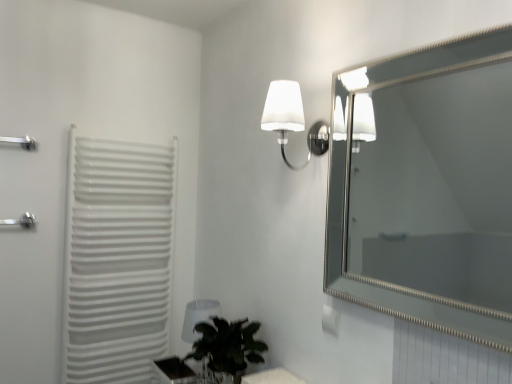
Question: Does green leafy plant at lower center appear on the right side of white plastic radiator at left?

Choices:
 (A) no
 (B) yes

Answer: (B)

Question: Can you confirm if green leafy plant at lower center is smaller than white plastic radiator at left?

Choices:
 (A) yes
 (B) no

Answer: (A)

Question: Is green leafy plant at lower center shorter than white plastic radiator at left?

Choices:
 (A) yes
 (B) no

Answer: (A)

Question: Would you say green leafy plant at lower center is outside white plastic radiator at left?

Choices:
 (A) yes
 (B) no

Answer: (A)

Question: Are green leafy plant at lower center and white plastic radiator at left located far from each other?

Choices:
 (A) yes
 (B) no

Answer: (B)

Question: From a real-world perspective, is green leafy plant at lower center positioned under white plastic radiator at left based on gravity?

Choices:
 (A) no
 (B) yes

Answer: (B)

Question: Is white plastic radiator at left bigger than white frosted glass wall sconce at upper center?

Choices:
 (A) no
 (B) yes

Answer: (B)

Question: Considering the relative positions of white plastic radiator at left and white frosted glass wall sconce at upper center in the image provided, is white plastic radiator at left behind white frosted glass wall sconce at upper center?

Choices:
 (A) no
 (B) yes

Answer: (B)

Question: Can you confirm if white plastic radiator at left is positioned to the right of white frosted glass wall sconce at upper center?

Choices:
 (A) no
 (B) yes

Answer: (A)

Question: Can you confirm if white plastic radiator at left is thinner than white frosted glass wall sconce at upper center?

Choices:
 (A) no
 (B) yes

Answer: (B)

Question: Is white plastic radiator at left taller than white frosted glass wall sconce at upper center?

Choices:
 (A) no
 (B) yes

Answer: (B)

Question: Does white plastic radiator at left have a greater width compared to white frosted glass wall sconce at upper center?

Choices:
 (A) yes
 (B) no

Answer: (B)

Question: From a real-world perspective, is transparent plastic table lamp at lower center physically above white plastic radiator at left?

Choices:
 (A) no
 (B) yes

Answer: (A)